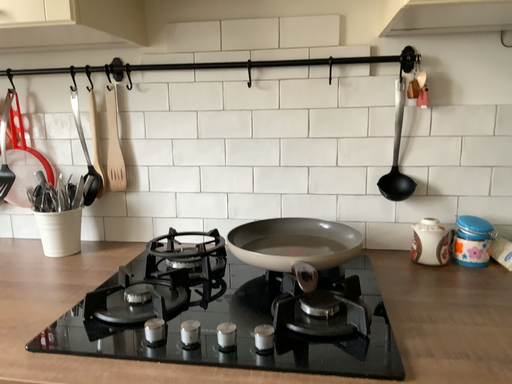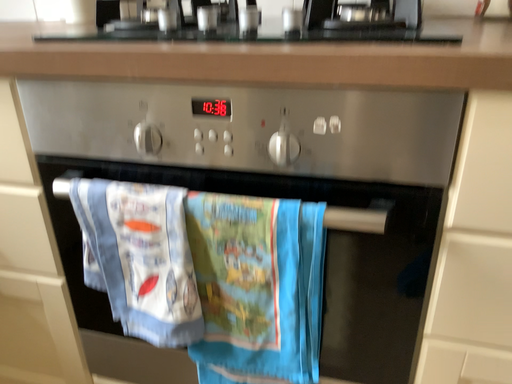
Question: Which way did the camera rotate in the video?

Choices:
 (A) rotated downward
 (B) rotated upward

Answer: (A)